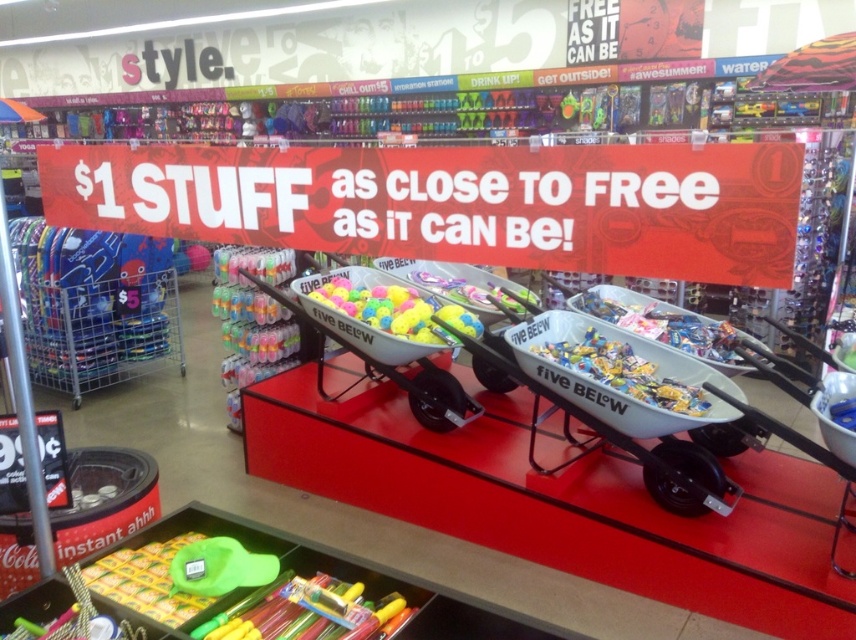
You are a customer at Five Below and want to grab a matte plastic balls at center from the display. The white plastic wheelbarrow at center is blocking your path. Can you step over it?

The white plastic wheelbarrow at center is much taller than matte plastic balls at center. Since the wheelbarrow is taller, it might be difficult to step over it comfortably, so it is not advisable to try stepping over the white plastic wheelbarrow at center.

You are a customer at the Five Below store and want to know if the white plastic wheelbarrow at center has enough space to hold the matte plastic balls at center. The balls require 10 inches of clearance to fit. Can the wheelbarrow accommodate them?

The white plastic wheelbarrow at center is 9.31 inches from matte plastic balls at center, which is less than the required 10 inches clearance. Therefore, the wheelbarrow cannot accommodate the matte plastic balls at center.